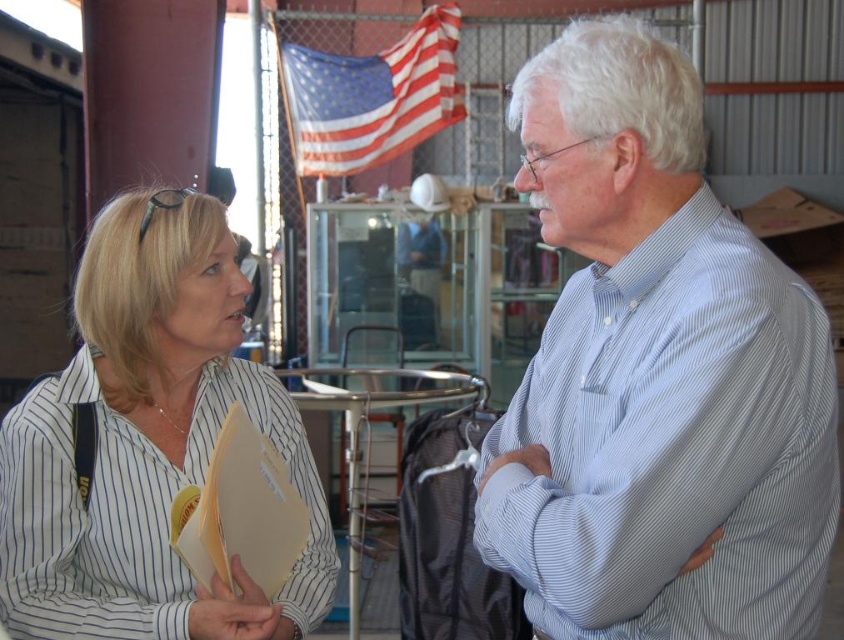
Which is more to the left, light blue striped shirt at center or american flag at upper center?

From the viewer's perspective, american flag at upper center appears more on the left side.

Is point (661, 298) positioned after point (358, 115)?

No, (661, 298) is closer to viewer.

The image size is (844, 640). In order to click on light blue striped shirt at center in this screenshot , I will do `click(656, 376)`.

Can you confirm if light blue striped shirt at center is positioned to the left of white striped shirt at left?

No, light blue striped shirt at center is not to the left of white striped shirt at left.

What do you see at coordinates (656, 376) in the screenshot? The height and width of the screenshot is (640, 844). I see `light blue striped shirt at center` at bounding box center [656, 376].

Locate an element on the screen. Image resolution: width=844 pixels, height=640 pixels. light blue striped shirt at center is located at coordinates (656, 376).

Does white striped shirt at left appear on the left side of american flag at upper center?

Correct, you'll find white striped shirt at left to the left of american flag at upper center.

Can you confirm if white striped shirt at left is smaller than american flag at upper center?

Yes.

You are a GUI agent. You are given a task and a screenshot of the screen. Output one action in this format:
    pyautogui.click(x=<x>, y=<y>)
    Task: Click on the white striped shirt at left
    
    Given the screenshot: What is the action you would take?
    pyautogui.click(x=145, y=442)